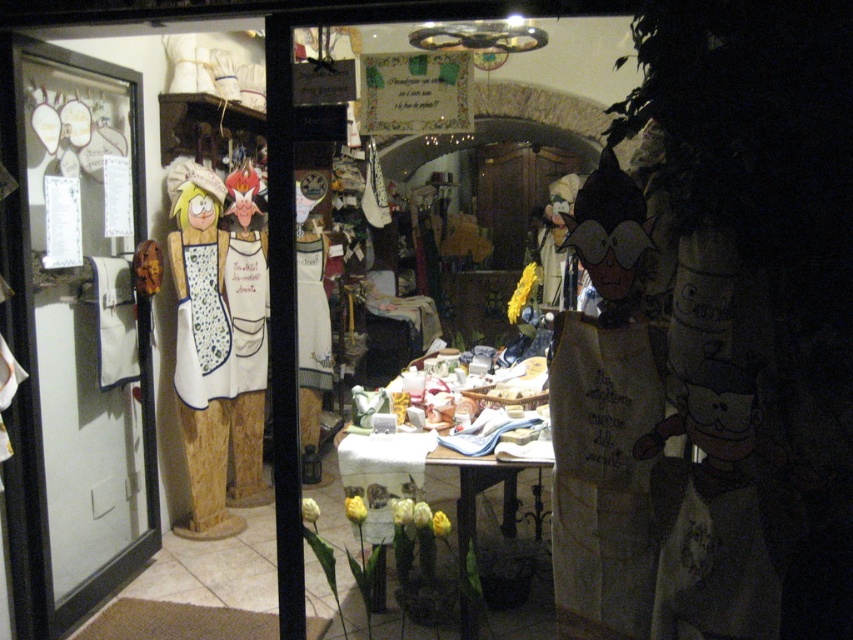
Question: Can you confirm if transparent glass door at left is smaller than matte white tablecloth at center?

Choices:
 (A) yes
 (B) no

Answer: (A)

Question: Observing the image, what is the correct spatial positioning of transparent glass door at left in reference to matte white tablecloth at center?

Choices:
 (A) right
 (B) left

Answer: (B)

Question: Among these objects, which one is farthest from the camera?

Choices:
 (A) transparent glass door at left
 (B) matte white tablecloth at center

Answer: (B)

Question: Which of the following is the farthest from the observer?

Choices:
 (A) (73, 227)
 (B) (579, 90)

Answer: (B)

Question: In this image, where is transparent glass door at left located relative to matte white tablecloth at center?

Choices:
 (A) left
 (B) right

Answer: (A)